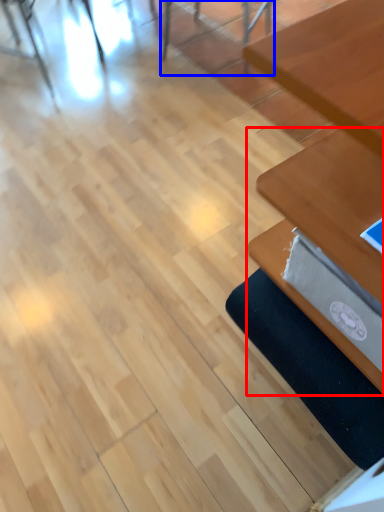
Question: Which of the following is the farthest to the observer, table (highlighted by a red box) or chair (highlighted by a blue box)?

Choices:
 (A) table
 (B) chair

Answer: (B)